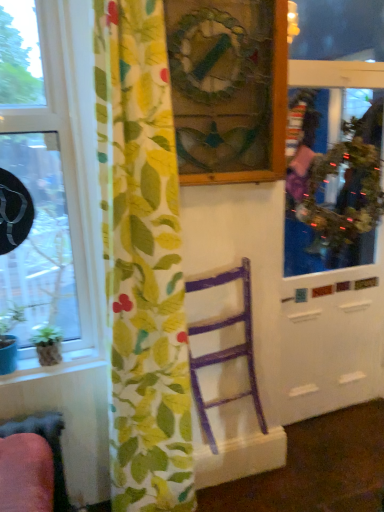
Locate an element on the screen. The image size is (384, 512). green textured wreath at upper right is located at coordinates (346, 187).

I want to click on transparent glass window at left, so click(54, 175).

Measure the distance between floral fabric curtain at left and camera.

They are 1.35 meters apart.

What are the coordinates of `green glossy houseplant at lower left` in the screenshot? It's located at (48, 345).

From the image's perspective, is purple wood chair at center positioned above or below wooden picture frame at upper center?

purple wood chair at center is situated lower than wooden picture frame at upper center in the image.

Does point (203, 416) lie behind point (208, 42)?

Yes, it is.

Is purple wood chair at center situated inside wooden picture frame at upper center or outside?

purple wood chair at center is located beyond the bounds of wooden picture frame at upper center.

How far apart are purple wood chair at center and wooden picture frame at upper center?

28.66 inches.

Which is more to the left, wooden picture frame at upper center or purple wood chair at center?

wooden picture frame at upper center.

Is point (170, 46) farther from camera compared to point (236, 346)?

No.

Is purple wood chair at center at the back of wooden picture frame at upper center?

No, wooden picture frame at upper center is not facing the opposite direction of purple wood chair at center.

From the image's perspective, is wooden picture frame at upper center located beneath purple wood chair at center?

Actually, wooden picture frame at upper center appears above purple wood chair at center in the image.

Looking at this image, considering the relative sizes of green glossy houseplant at lower left and purple wood chair at center in the image provided, is green glossy houseplant at lower left wider than purple wood chair at center?

In fact, green glossy houseplant at lower left might be narrower than purple wood chair at center.

From the image's perspective, is green glossy houseplant at lower left under purple wood chair at center?

Incorrect, from the image's perspective, green glossy houseplant at lower left is higher than purple wood chair at center.

Does point (48, 356) lie behind point (204, 356)?

No, it is in front of (204, 356).

Is transparent glass window at left aimed at floral fabric curtain at left?

No, transparent glass window at left is not facing towards floral fabric curtain at left.

From the image's perspective, is transparent glass window at left above or below floral fabric curtain at left?

Based on their image positions, transparent glass window at left is located above floral fabric curtain at left.

Considering the points (55, 121) and (126, 68), which point is behind, point (55, 121) or point (126, 68)?

The point (55, 121) is farther.

Who is taller, transparent glass window at left or floral fabric curtain at left?

With more height is floral fabric curtain at left.

Which of these two, metallic reflective screen door at right or floral fabric curtain at left, is thinner?

metallic reflective screen door at right.

Is metallic reflective screen door at right completely or partially outside of floral fabric curtain at left?

Indeed, metallic reflective screen door at right is completely outside floral fabric curtain at left.

Would you say metallic reflective screen door at right is a long distance from floral fabric curtain at left?

Yes, metallic reflective screen door at right and floral fabric curtain at left are quite far apart.

Is green textured wreath at upper right wider than transparent glass window at left?

Yes, green textured wreath at upper right is wider than transparent glass window at left.

Is green textured wreath at upper right closer to camera compared to transparent glass window at left?

No, green textured wreath at upper right is further to the viewer.

Does green textured wreath at upper right appear on the left side of transparent glass window at left?

No.

Based on their sizes in the image, would you say wooden picture frame at upper center is bigger or smaller than metallic reflective screen door at right?

wooden picture frame at upper center is smaller than metallic reflective screen door at right.

How many degrees apart are the facing directions of wooden picture frame at upper center and metallic reflective screen door at right?

They differ by 2.94 degrees in their facing directions.

From the image's perspective, which object appears higher, wooden picture frame at upper center or metallic reflective screen door at right?

wooden picture frame at upper center, from the image's perspective.

Considering the positions of points (198, 71) and (326, 312), is point (198, 71) farther from camera compared to point (326, 312)?

No, it is in front of (326, 312).

Image resolution: width=384 pixels, height=512 pixels. There is a purple wood chair at center. What are the coordinates of `picture frame above it (from a real-world perspective)` in the screenshot? It's located at (228, 88).

This screenshot has height=512, width=384. In order to click on furniture below the wooden picture frame at upper center (from the image's perspective) in this screenshot , I will do `click(224, 349)`.

Based on their spatial positions, is wooden picture frame at upper center or green textured wreath at upper right further from transparent glass window at left?

green textured wreath at upper right is further to transparent glass window at left.

Looking at the image, which one is located further to wooden picture frame at upper center, green glossy houseplant at lower left or transparent glass window at left?

Based on the image, green glossy houseplant at lower left appears to be further to wooden picture frame at upper center.

Considering their positions, is metallic reflective screen door at right positioned closer to purple wood chair at center than floral fabric curtain at left?

floral fabric curtain at left is closer to purple wood chair at center.

Considering their positions, is metallic reflective screen door at right positioned closer to green textured wreath at upper right than wooden picture frame at upper center?

metallic reflective screen door at right lies closer to green textured wreath at upper right than the other object.

Looking at the image, which one is located further to wooden picture frame at upper center, floral fabric curtain at left or green glossy houseplant at lower left?

green glossy houseplant at lower left is positioned further to the anchor wooden picture frame at upper center.

From the picture: From the image, which object appears to be nearer to green textured wreath at upper right, transparent glass window at left or purple wood chair at center?

purple wood chair at center.

Considering their positions, is transparent glass window at left positioned further to green glossy houseplant at lower left than metallic reflective screen door at right?

Based on the image, metallic reflective screen door at right appears to be further to green glossy houseplant at lower left.

Considering their positions, is green glossy houseplant at lower left positioned further to transparent glass window at left than purple wood chair at center?

Among the two, purple wood chair at center is located further to transparent glass window at left.

The width and height of the screenshot is (384, 512). What are the coordinates of `screen door between green glossy houseplant at lower left and green textured wreath at upper right from left to right` in the screenshot? It's located at (332, 332).

Locate an element on the screen. Image resolution: width=384 pixels, height=512 pixels. curtain between green glossy houseplant at lower left and metallic reflective screen door at right in the horizontal direction is located at coordinates (142, 262).

At what (x,y) coordinates should I click in order to perform the action: click on furniture between green glossy houseplant at lower left and green textured wreath at upper right from left to right. Please return your answer as a coordinate pair (x, y). The height and width of the screenshot is (512, 384). Looking at the image, I should click on (224, 349).

Locate an element on the screen. picture frame situated between green glossy houseplant at lower left and metallic reflective screen door at right from left to right is located at coordinates point(228,88).